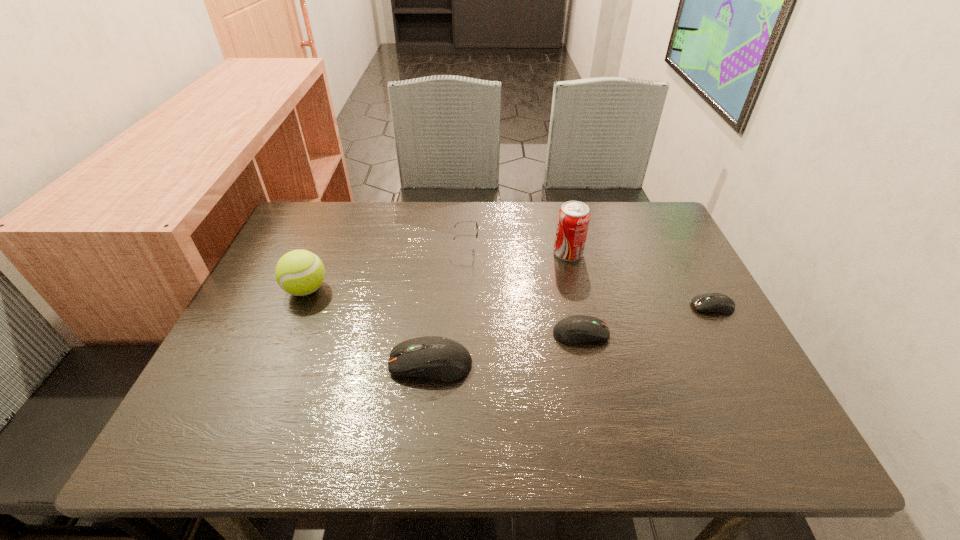
Please show where to add a computer equipment on the left while keeping spacing even. Please provide its 2D coordinates. Your answer should be formatted as a tuple, i.e. [(x, y)], where the tuple contains the x and y coordinates of a point satisfying the conditions above.

[(260, 398)]